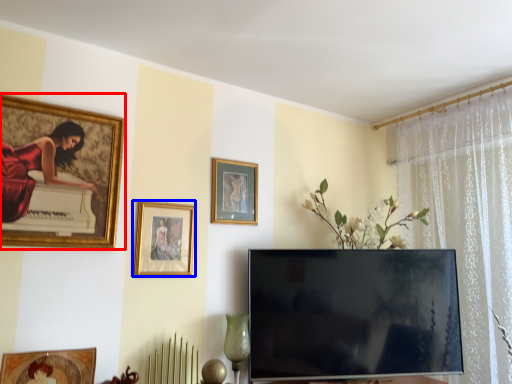
Question: Which of the following is the closest to the observer, picture frame (highlighted by a red box) or picture frame (highlighted by a blue box)?

Choices:
 (A) picture frame
 (B) picture frame

Answer: (A)